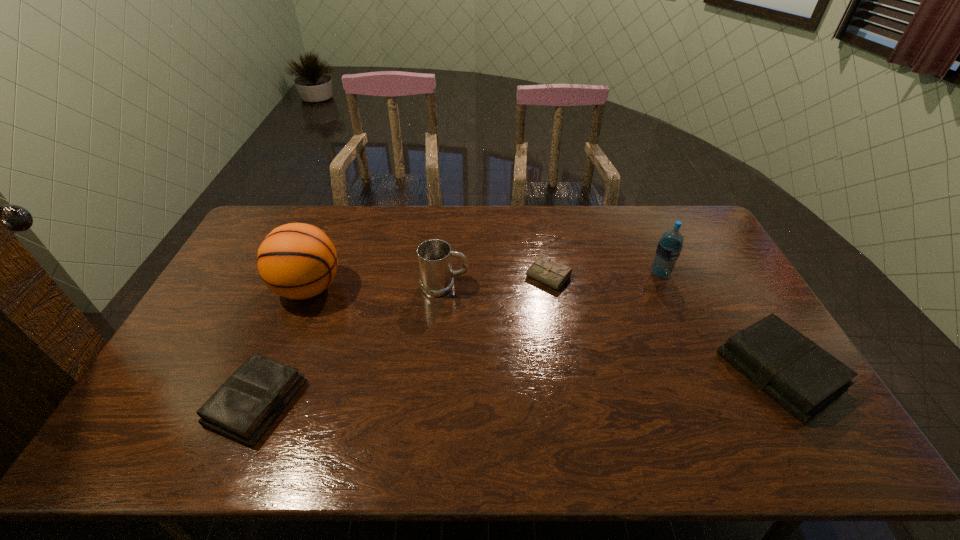
In order to click on vacant space at the left edge of the desktop in this screenshot , I will do `click(249, 258)`.

Find the location of a particular element. blank space at the right edge of the desktop is located at coordinates (715, 330).

The height and width of the screenshot is (540, 960). I want to click on vacant area at the far right corner, so click(x=691, y=244).

At what (x,y) coordinates should I click in order to perform the action: click on empty space between the basketball and the fifth tallest object. Please return your answer as a coordinate pair (x, y). Looking at the image, I should click on (282, 345).

I want to click on empty space between the rightmost object and the mug, so click(612, 328).

Locate an element on the screen. The height and width of the screenshot is (540, 960). free space between the fifth tallest object and the rightmost object is located at coordinates (517, 387).

Where is `free point between the third object from left to right and the taller book`? free point between the third object from left to right and the taller book is located at coordinates coord(612,328).

This screenshot has height=540, width=960. I want to click on empty space that is in between the fourth shortest object and the shorter book, so click(350, 344).

At what (x,y) coordinates should I click in order to perform the action: click on free point between the basketball and the fifth object from left to right. Please return your answer as a coordinate pair (x, y). The width and height of the screenshot is (960, 540). Looking at the image, I should click on click(484, 281).

At what (x,y) coordinates should I click in order to perform the action: click on free space that is in between the mug and the basketball. Please return your answer as a coordinate pair (x, y). Image resolution: width=960 pixels, height=540 pixels. Looking at the image, I should click on (376, 287).